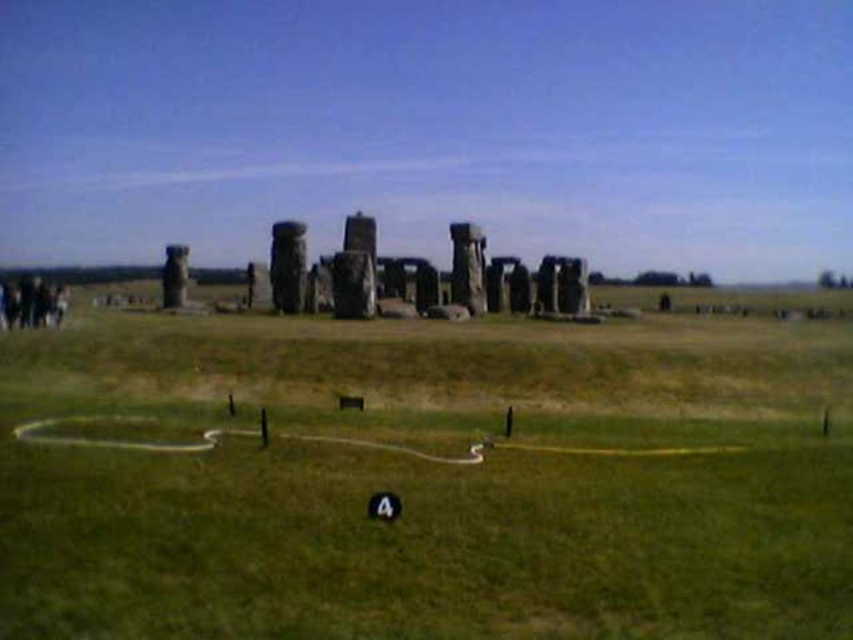
Question: Does dark brown hair at lower left appear on the right side of smooth gray stone monument at left?

Choices:
 (A) yes
 (B) no

Answer: (B)

Question: Which point is closer to the camera?

Choices:
 (A) green grassy field at center
 (B) smooth gray stone monument at left
 (C) dark brown hair at lower left

Answer: (A)

Question: Is dark brown hair at lower left to the right of smooth gray stone monument at left from the viewer's perspective?

Choices:
 (A) no
 (B) yes

Answer: (A)

Question: Is green grassy field at center below dark brown hair at lower left?

Choices:
 (A) yes
 (B) no

Answer: (A)

Question: Which of the following is the farthest from the observer?

Choices:
 (A) (49, 301)
 (B) (543, 595)
 (C) (166, 284)

Answer: (C)

Question: Which object appears farthest from the camera in this image?

Choices:
 (A) green grassy field at center
 (B) dark brown hair at lower left
 (C) smooth gray stone monument at left

Answer: (C)